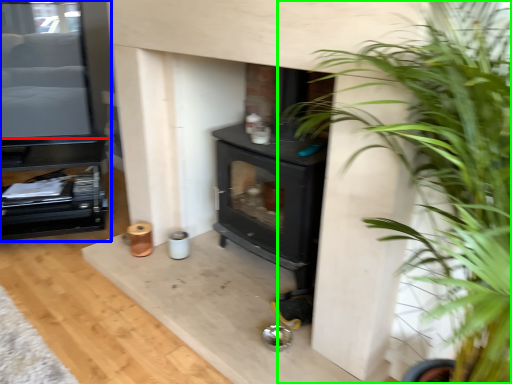
Question: Which object is positioned closest to entertainment center (highlighted by a red box)? Select from entertainment center (highlighted by a blue box) and houseplant (highlighted by a green box).

Choices:
 (A) entertainment center
 (B) houseplant

Answer: (A)